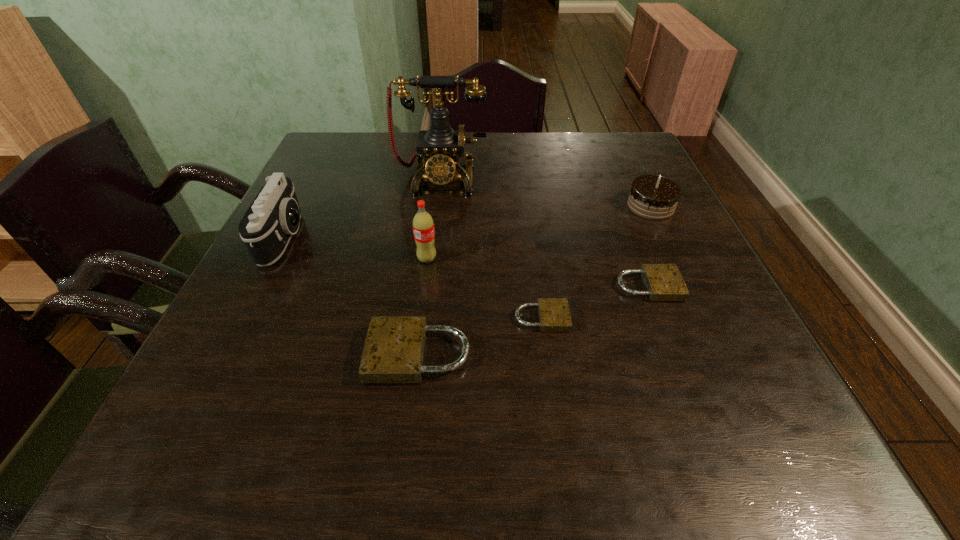
Please point out where to position a new padlock on the left to maintain spacing. Please provide its 2D coordinates. Your answer should be formatted as a tuple, i.e. [(x, y)], where the tuple contains the x and y coordinates of a point satisfying the conditions above.

[(276, 397)]